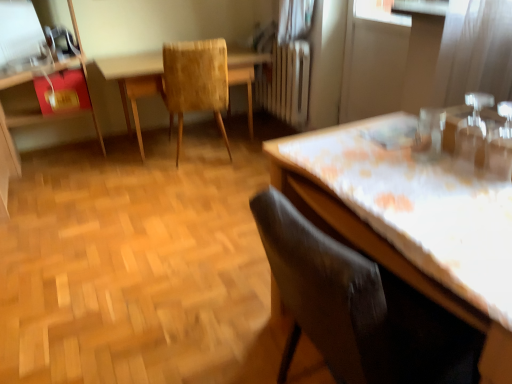
The width and height of the screenshot is (512, 384). What are the coordinates of `vacant point to the left of velvet dark brown chair at lower right, positioned as the 2th chair in back-to-front order` in the screenshot? It's located at (211, 341).